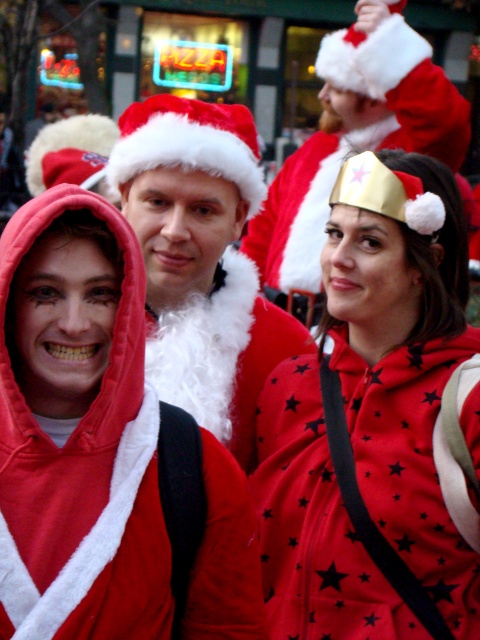
Can you confirm if fuzzy red coat at center is shorter than velvet santa hat at center?

No.

Measure the distance between point (249,406) and camera.

They are 5.90 meters apart.

Is point (227, 211) behind point (331, 168)?

No, it is in front of (331, 168).

Where is `fuzzy red coat at center`? This screenshot has height=640, width=480. fuzzy red coat at center is located at coordinates (201, 260).

Does red fleece jacket at center have a greater width compared to fuzzy red coat at center?

In fact, red fleece jacket at center might be narrower than fuzzy red coat at center.

Is red fleece jacket at center to the left of fuzzy red coat at center from the viewer's perspective?

Indeed, red fleece jacket at center is positioned on the left side of fuzzy red coat at center.

Which is behind, point (15, 244) or point (227, 310)?

Positioned behind is point (227, 310).

I want to click on red fleece jacket at center, so click(x=78, y=429).

Who is positioned more to the left, matte gold crown at center or fuzzy red coat at center?

From the viewer's perspective, fuzzy red coat at center appears more on the left side.

Who is shorter, matte gold crown at center or fuzzy red coat at center?

fuzzy red coat at center

The width and height of the screenshot is (480, 640). What are the coordinates of `matte gold crown at center` in the screenshot? It's located at (375, 422).